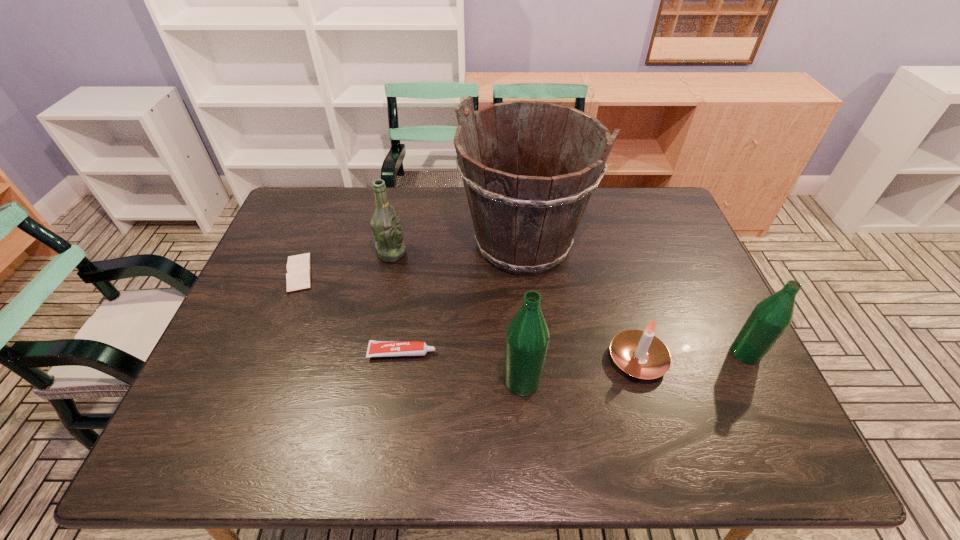
Where is `object that is at the right edge`? The image size is (960, 540). object that is at the right edge is located at coordinates (770, 318).

Locate an element on the screen. The image size is (960, 540). blank space at the far edge is located at coordinates (596, 225).

Locate an element on the screen. The image size is (960, 540). free space at the near edge of the desktop is located at coordinates (332, 411).

At what (x,y) coordinates should I click in order to perform the action: click on free location at the right edge. Please return your answer as a coordinate pair (x, y). The width and height of the screenshot is (960, 540). Looking at the image, I should click on (693, 255).

At what (x,y) coordinates should I click in order to perform the action: click on vacant space at the far left corner. Please return your answer as a coordinate pair (x, y). Image resolution: width=960 pixels, height=540 pixels. Looking at the image, I should click on pos(342,190).

What are the coordinates of `blank space at the near left corner` in the screenshot? It's located at (248, 402).

I want to click on vacant region at the far right corner of the desktop, so click(643, 214).

The height and width of the screenshot is (540, 960). In order to click on free area in between the beer bottle and the diary in this screenshot , I will do `click(346, 263)`.

Locate an element on the screen. The width and height of the screenshot is (960, 540). vacant space in between the bucket and the beer bottle is located at coordinates pos(457,248).

I want to click on vacant area that lies between the left bottle and the diary, so click(411, 327).